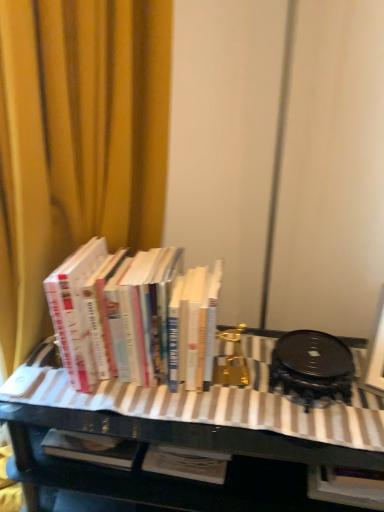
Question: Is black glossy table at center wider or thinner than hardcover books at left?

Choices:
 (A) thin
 (B) wide

Answer: (B)

Question: Relative to hardcover books at left, is black glossy table at center in front or behind?

Choices:
 (A) behind
 (B) front

Answer: (B)

Question: Which object is the farthest from the yellow fabric curtain at upper left?

Choices:
 (A) black glossy table at center
 (B) hardcover books at left

Answer: (A)

Question: Which object is positioned closest to the black glossy table at center?

Choices:
 (A) yellow fabric curtain at upper left
 (B) hardcover books at left

Answer: (B)